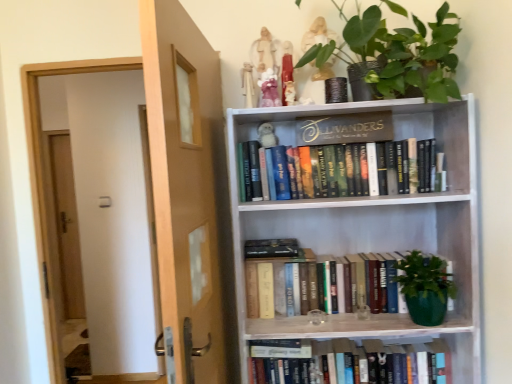
Question: Considering the relative positions of gold metallic sign at upper center and green matte plant at upper center in the image provided, is gold metallic sign at upper center in front of green matte plant at upper center?

Choices:
 (A) yes
 (B) no

Answer: (B)

Question: Does gold metallic sign at upper center come behind green matte plant at upper center?

Choices:
 (A) yes
 (B) no

Answer: (A)

Question: Can you confirm if gold metallic sign at upper center is smaller than green matte plant at upper center?

Choices:
 (A) no
 (B) yes

Answer: (B)

Question: Considering the relative sizes of gold metallic sign at upper center and green matte plant at upper center in the image provided, is gold metallic sign at upper center shorter than green matte plant at upper center?

Choices:
 (A) no
 (B) yes

Answer: (B)

Question: Considering the relative positions of gold metallic sign at upper center and green matte plant at upper center in the image provided, is gold metallic sign at upper center to the left of green matte plant at upper center from the viewer's perspective?

Choices:
 (A) yes
 (B) no

Answer: (A)

Question: Does gold metallic sign at upper center have a greater width compared to green matte plant at upper center?

Choices:
 (A) no
 (B) yes

Answer: (A)

Question: Can you confirm if white wood bookcase at upper right is positioned to the right of green matte plant at upper center?

Choices:
 (A) no
 (B) yes

Answer: (A)

Question: Can you confirm if white wood bookcase at upper right is positioned to the left of green matte plant at upper center?

Choices:
 (A) no
 (B) yes

Answer: (B)

Question: Does white wood bookcase at upper right have a lesser width compared to green matte plant at upper center?

Choices:
 (A) no
 (B) yes

Answer: (B)

Question: Is white wood bookcase at upper right oriented away from green matte plant at upper center?

Choices:
 (A) yes
 (B) no

Answer: (B)

Question: Is white wood bookcase at upper right not close to green matte plant at upper center?

Choices:
 (A) no
 (B) yes

Answer: (A)

Question: From the image's perspective, is white wood bookcase at upper right above green matte plant at upper center?

Choices:
 (A) no
 (B) yes

Answer: (A)

Question: Does hardcover books at center, the second book ordered from the bottom, turn towards green matte plant at upper center?

Choices:
 (A) no
 (B) yes

Answer: (A)